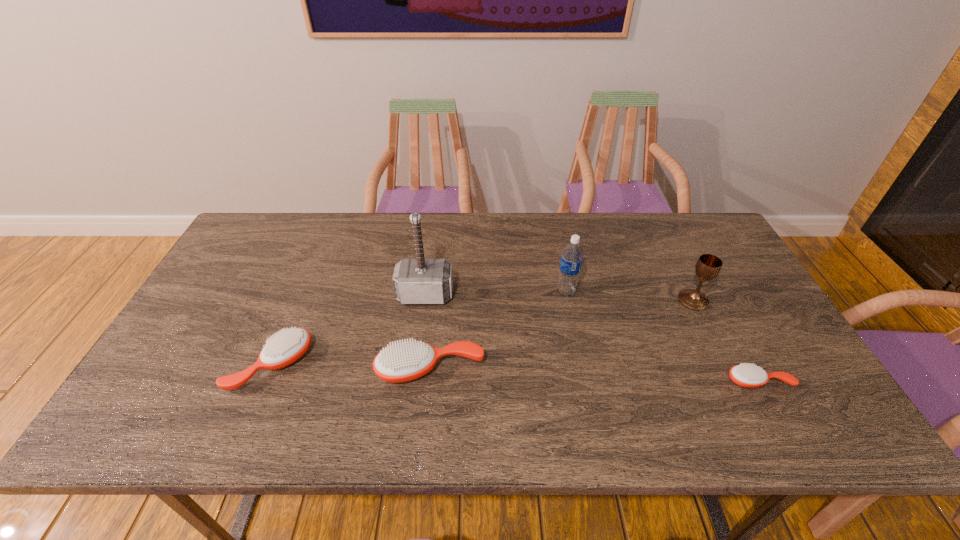
Where is `the second shortest object`? This screenshot has width=960, height=540. the second shortest object is located at coordinates (284, 348).

This screenshot has width=960, height=540. Identify the location of the second shortest hairbrush. click(284, 348).

Find the location of a particular element. This screenshot has width=960, height=540. the second hairbrush from right to left is located at coordinates (405, 361).

Where is `the shortest object`? The height and width of the screenshot is (540, 960). the shortest object is located at coordinates (750, 376).

The height and width of the screenshot is (540, 960). Find the location of `the rightmost hairbrush`. the rightmost hairbrush is located at coordinates (750, 376).

I want to click on chalice, so click(x=708, y=266).

Where is `water bottle`? Image resolution: width=960 pixels, height=540 pixels. water bottle is located at coordinates (572, 254).

Identify the location of the third object from right to left. This screenshot has width=960, height=540. (572, 254).

You are a GUI agent. You are given a task and a screenshot of the screen. Output one action in this format:
    pyautogui.click(x=<x>, y=<y>)
    Task: Click on the hammer
    The width and height of the screenshot is (960, 540).
    Given the screenshot: What is the action you would take?
    pyautogui.click(x=416, y=281)

The width and height of the screenshot is (960, 540). Find the location of `free space located on the back of the second shortest hairbrush`. free space located on the back of the second shortest hairbrush is located at coordinates (297, 304).